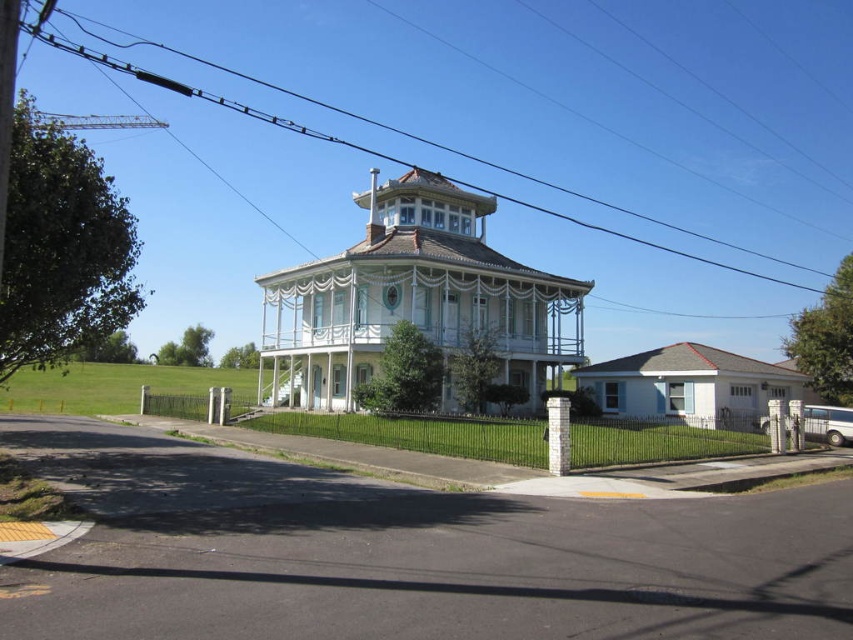
The height and width of the screenshot is (640, 853). What do you see at coordinates (395, 131) in the screenshot? I see `black wire at upper center` at bounding box center [395, 131].

Is point (596, 198) farther from camera compared to point (569, 444)?

Yes, it is.

Measure the distance between point (112, 42) and camera.

Point (112, 42) is 126.37 meters away from camera.

Identify the location of black wire at upper center. This screenshot has width=853, height=640. (395, 131).

Does black wire at upper center lie in front of white painted wood post at center?

No, black wire at upper center is further to the viewer.

Who is positioned more to the left, black wire at upper center or white painted wood post at center?

Positioned to the left is black wire at upper center.

Find the location of a particular element. The height and width of the screenshot is (640, 853). black wire at upper center is located at coordinates (395, 131).

Identify the location of black wire at upper center. (x=395, y=131).

Can you confirm if white stone column at center is bigger than white painted wood post at center?

Yes, white stone column at center is bigger than white painted wood post at center.

Does point (550, 468) come closer to viewer compared to point (776, 445)?

That is True.

Image resolution: width=853 pixels, height=640 pixels. In order to click on white stone column at center in this screenshot , I will do `click(558, 435)`.